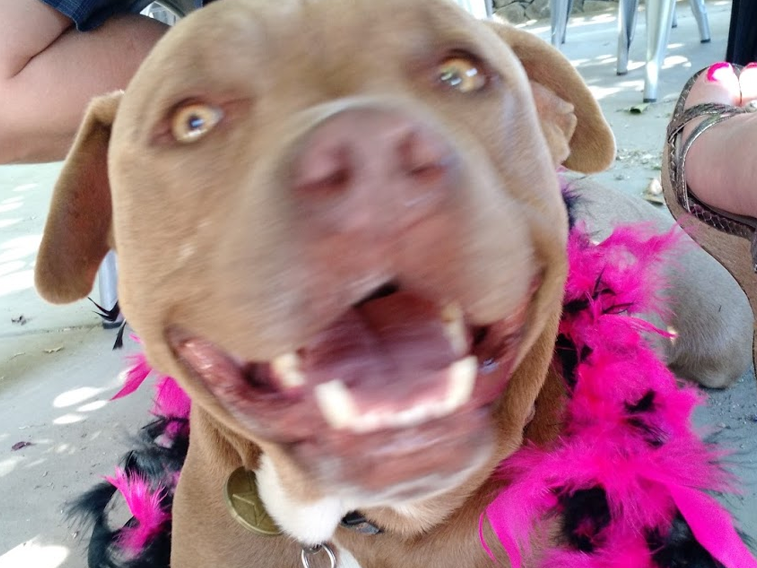
Locate an element on the screen. This screenshot has height=568, width=757. floor is located at coordinates (61, 399), (35, 291), (640, 124).